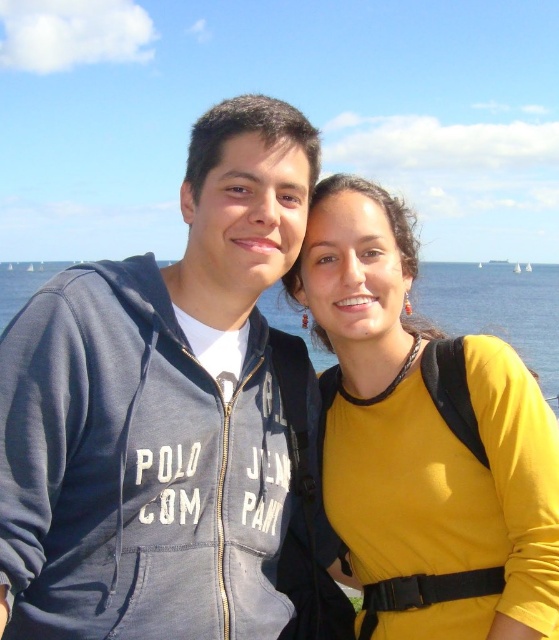
Consider the image. Between dark blue zip-up hoodie at center and yellow matte shirt at center, which one is positioned lower?

yellow matte shirt at center is lower down.

Identify the location of dark blue zip-up hoodie at center. (158, 412).

Is point (210, 378) positioned before point (479, 531)?

No, it is not.

At what (x,y) coordinates should I click in order to perform the action: click on dark blue zip-up hoodie at center. Please return your answer as a coordinate pair (x, y). Image resolution: width=559 pixels, height=640 pixels. Looking at the image, I should click on 158,412.

Between dark blue zip-up hoodie at center and white sailboat at center, which one is positioned higher?

white sailboat at center

Is dark blue zip-up hoodie at center wider than white sailboat at center?

No.

This screenshot has width=559, height=640. Describe the element at coordinates (158, 412) in the screenshot. I see `dark blue zip-up hoodie at center` at that location.

Find the location of `dark blue zip-up hoodie at center`. dark blue zip-up hoodie at center is located at coordinates (158, 412).

Locate an element on the screen. yellow matte shirt at center is located at coordinates (423, 444).

Can you confirm if yellow matte shirt at center is positioned above blue water at center?

Actually, yellow matte shirt at center is below blue water at center.

Is point (352, 316) positioned before point (556, 388)?

Yes, it is in front of point (556, 388).

Where is `yellow matte shirt at center`? This screenshot has height=640, width=559. yellow matte shirt at center is located at coordinates (423, 444).